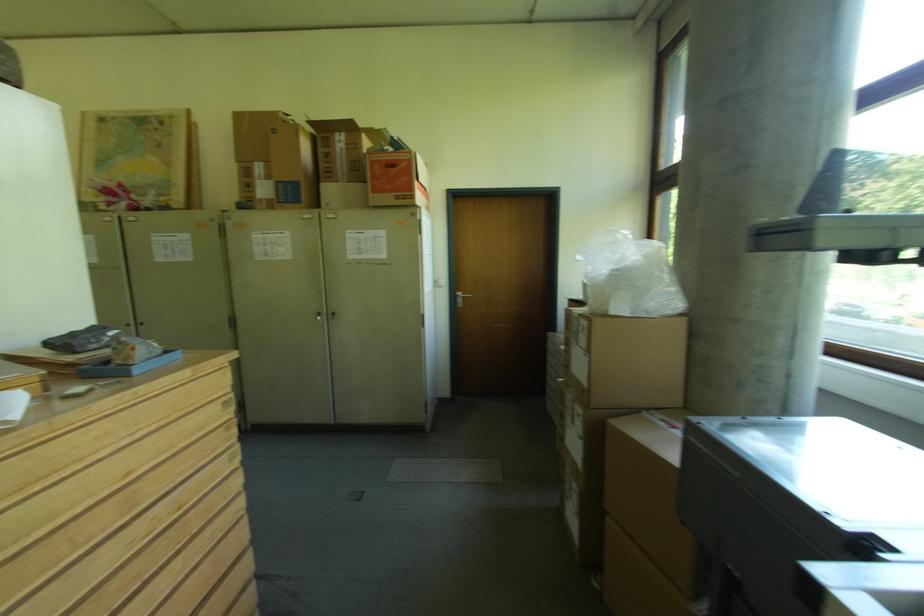
You are a GUI agent. You are given a task and a screenshot of the screen. Output one action in this format:
    pyautogui.click(x=<x>, y=<y>)
    Task: Click on the silver door handle
    The height and width of the screenshot is (616, 924).
    Given the screenshot: What is the action you would take?
    pyautogui.click(x=459, y=298)